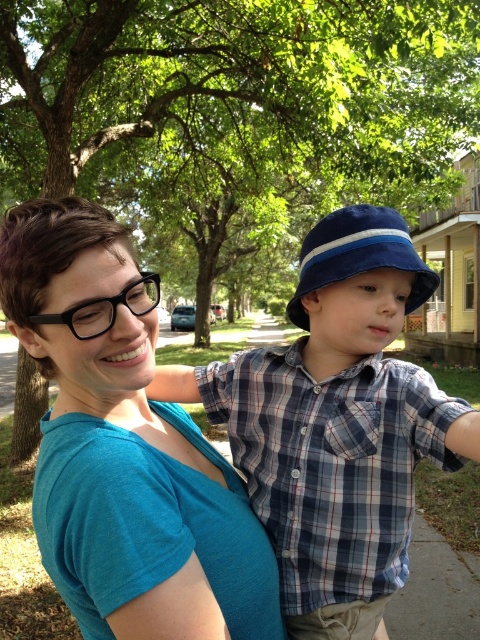
Question: Which object is farther from the camera taking this photo?

Choices:
 (A) teal matte shirt at center
 (B) blue fabric hat at center

Answer: (B)

Question: Which point is closer to the camera?

Choices:
 (A) (201, 392)
 (B) (62, 481)

Answer: (B)

Question: Does teal matte shirt at center have a lesser width compared to blue fabric hat at center?

Choices:
 (A) yes
 (B) no

Answer: (A)

Question: Among these objects, which one is farthest from the camera?

Choices:
 (A) teal matte shirt at center
 (B) blue fabric hat at center
 (C) blue plaid shirt at center

Answer: (B)

Question: Considering the relative positions of blue plaid shirt at center and blue fabric hat at center in the image provided, where is blue plaid shirt at center located with respect to blue fabric hat at center?

Choices:
 (A) right
 (B) left

Answer: (B)

Question: Does teal matte shirt at center appear over blue plaid shirt at center?

Choices:
 (A) no
 (B) yes

Answer: (A)